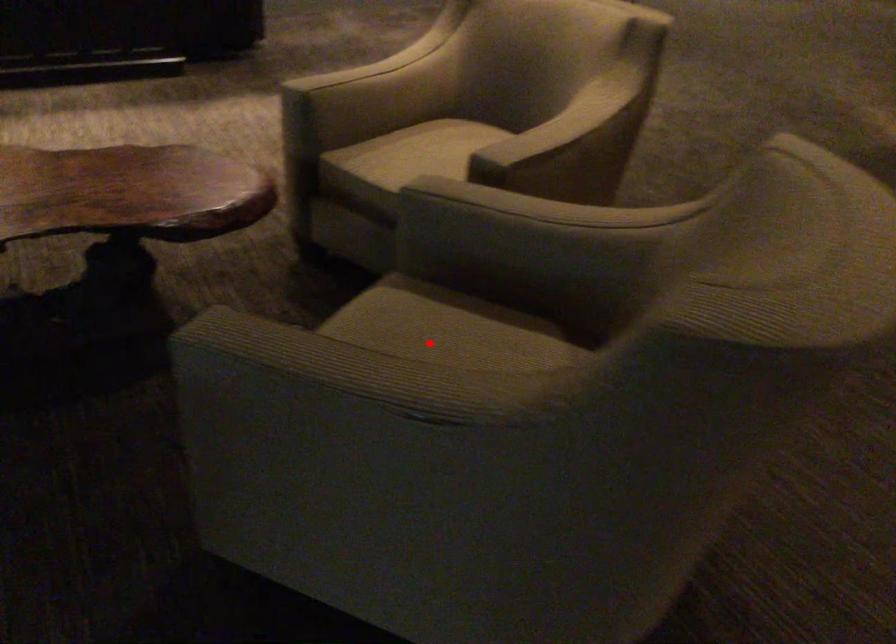
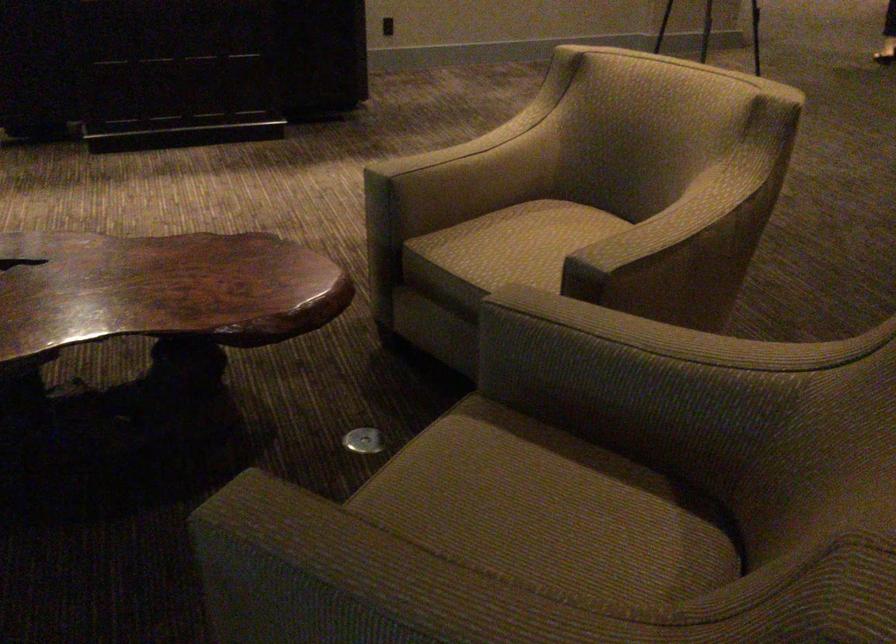
Where in the second image is the point corresponding to the highlighted location from the first image?

(512, 498)